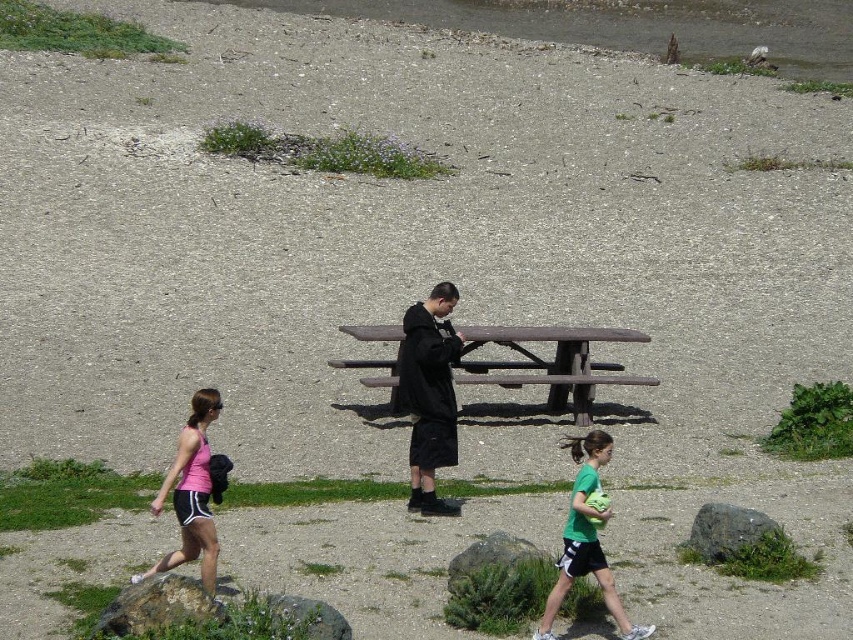
You are planning to place a small garden statue between the rough textured rock at lower left and the gray rough rock at center. The statue requires a minimum of 2 meters of space between the two rocks to be placed safely. Can you place the statue there?

The rough textured rock at lower left is 3.44 meters from gray rough rock at center, so yes, the statue can be placed between them since the distance is more than the required 2 meters.

You are standing at the edge of the gravel path in the park scene. You see the pink fabric tank top at lower left and the gray rock at lower center. Which object is nearer to you?

The pink fabric tank top at lower left is closer to the viewer than the gray rock at lower center.

You are planning to place a small potted plant between the brown wooden bench at center and the gray rough rock at center. Based on the scene description, which object should the plant be closer to?

The brown wooden bench at center is positioned on the left side of the gray rough rock at center, so the plant should be placed closer to the brown wooden bench at center to maintain symmetry.